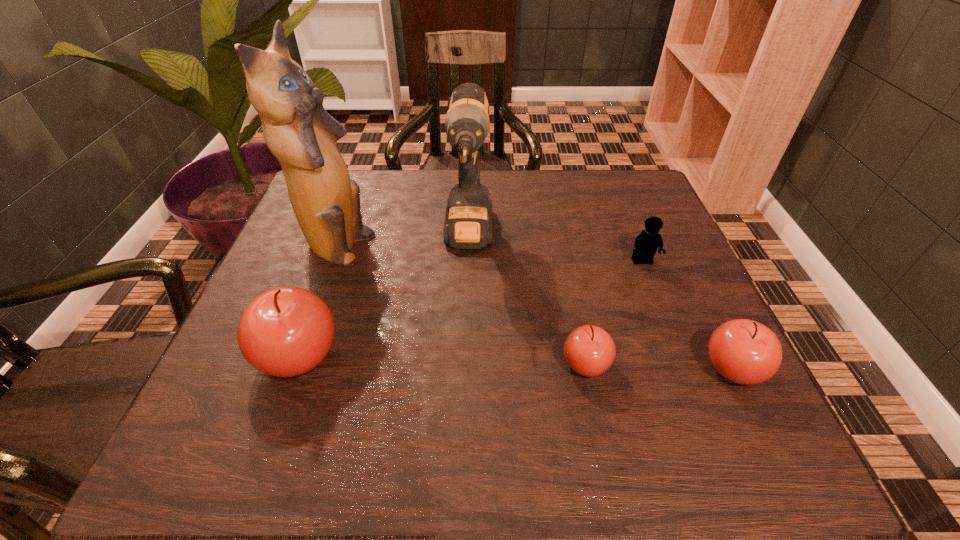
At what (x,y) coordinates should I click in order to perform the action: click on free space located 0.130m on the left of the third object from right to left. Please return your answer as a coordinate pair (x, y). Looking at the image, I should click on (489, 364).

The height and width of the screenshot is (540, 960). I want to click on free space located on the left of the rightmost apple, so click(x=668, y=368).

Find the location of a particular element. Image resolution: width=960 pixels, height=540 pixels. free space located with the drill bit of the fifth shortest object facing forward is located at coordinates (466, 350).

Find the location of `vacant region located 0.230m on the front-facing side of the Lego`. vacant region located 0.230m on the front-facing side of the Lego is located at coordinates (679, 354).

Where is `vacant region located 0.390m on the face of the cat`? Image resolution: width=960 pixels, height=540 pixels. vacant region located 0.390m on the face of the cat is located at coordinates [x=540, y=249].

Where is `object positioned at the far edge`? object positioned at the far edge is located at coordinates (468, 221).

This screenshot has width=960, height=540. I want to click on apple at the left edge, so tap(287, 331).

Locate an element on the screen. Image resolution: width=960 pixels, height=540 pixels. cat positioned at the left edge is located at coordinates (298, 131).

You are a GUI agent. You are given a task and a screenshot of the screen. Output one action in this format:
    pyautogui.click(x=<x>, y=<y>)
    Task: Click on the apple present at the right edge
    The height and width of the screenshot is (540, 960).
    Given the screenshot: What is the action you would take?
    pyautogui.click(x=743, y=351)

The image size is (960, 540). In order to click on Lego that is at the right edge in this screenshot , I will do `click(646, 244)`.